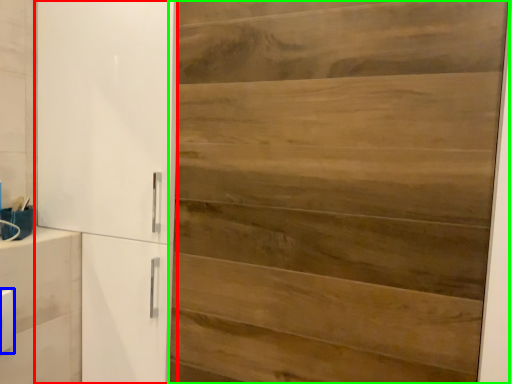
Question: Which object is positioned farthest from cupboard (highlighted by a red box)? Select from light switch (highlighted by a blue box) and door (highlighted by a green box).

Choices:
 (A) light switch
 (B) door

Answer: (A)